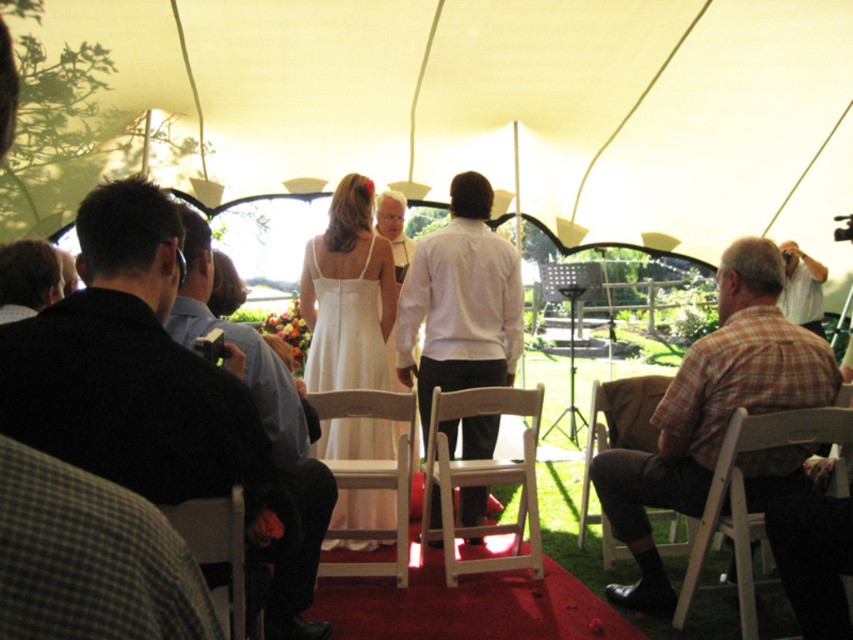
You are attending a wedding ceremony under a large white tent. You notice a point at coordinates (268, 438). Based on the scene description, which object is located at that point?

The point at coordinates (268, 438) is on the dark blue shirt at center.

You are a photographer at the wedding ceremony. You need to capture a photo of the dark blue shirt at center and the white wood chair at center. Which object is positioned higher in the image?

The dark blue shirt at center is located above the white wood chair at center, so it is positioned higher in the image.

You are a photographer positioned at the front of the wedding ceremony tent. You want to take a photo that includes both point A at point (229, 516) and point B at point (814, 308). Which point will appear larger in the photo?

Point A at point (229, 516) will appear larger in the photo because it is closer to the camera than point B at point (814, 308).